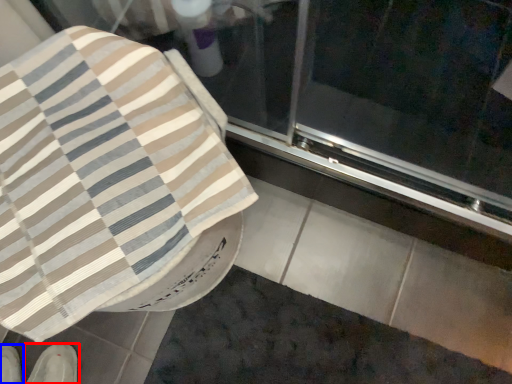
Question: Which of the following is the closest to the observer, footwear (highlighted by a red box) or footwear (highlighted by a blue box)?

Choices:
 (A) footwear
 (B) footwear

Answer: (A)